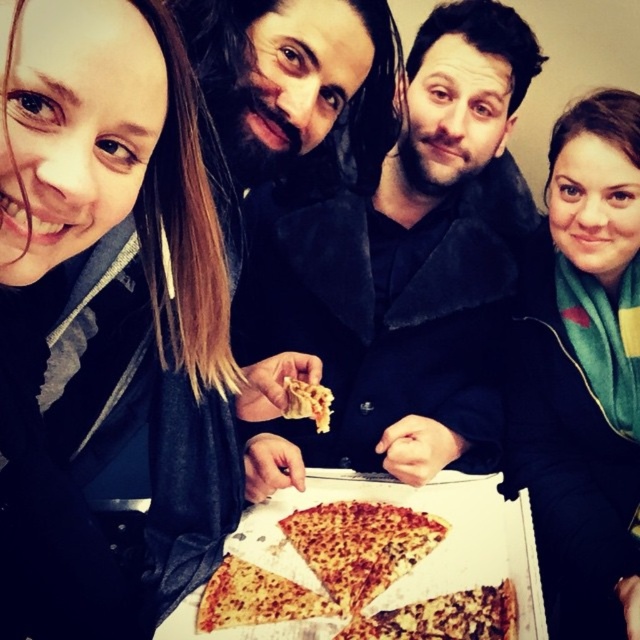
Is point (627, 500) more distant than point (417, 502)?

Yes, point (627, 500) is behind point (417, 502).

Does green scarf at upper right have a greater height compared to white cardboard box at center?

Yes, green scarf at upper right is taller than white cardboard box at center.

Describe the element at coordinates (582, 371) in the screenshot. I see `green scarf at upper right` at that location.

Locate an element on the screen. green scarf at upper right is located at coordinates (582, 371).

Between dark blue coat at center and cheesy pizza at center, which one is positioned lower?

cheesy pizza at center

Who is shorter, dark blue coat at center or cheesy pizza at center?

cheesy pizza at center is shorter.

Who is more forward, (340, 211) or (300, 616)?

Point (300, 616)

At what (x,y) coordinates should I click in order to perform the action: click on dark blue coat at center. Please return your answer as a coordinate pair (x, y). This screenshot has width=640, height=640. Looking at the image, I should click on (404, 272).

Who is positioned more to the left, cheesy pizza at center or cheesy crusty pizza at center?

From the viewer's perspective, cheesy pizza at center appears more on the left side.

Measure the distance from cheesy pizza at center to cheesy crusty pizza at center.

9.77 inches

Is point (250, 602) behind point (317, 416)?

Yes, point (250, 602) is behind point (317, 416).

This screenshot has height=640, width=640. I want to click on cheesy pizza at center, so click(256, 596).